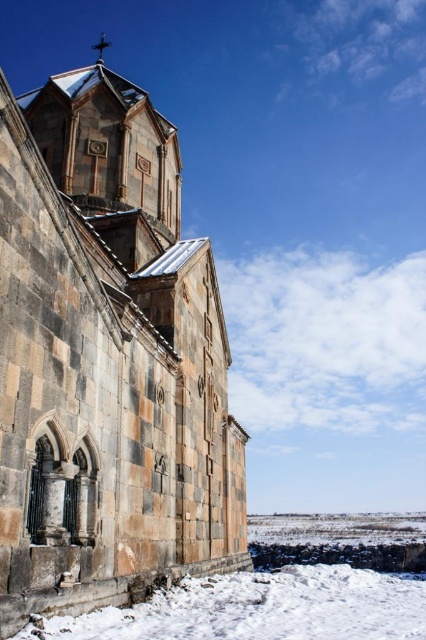
Between rustic stone church at center and white powdery snow at lower center, which one has more height?

Standing taller between the two is rustic stone church at center.

This screenshot has height=640, width=426. What do you see at coordinates (106, 356) in the screenshot?
I see `rustic stone church at center` at bounding box center [106, 356].

Between point (14, 189) and point (394, 614), which one is positioned behind?

The point (394, 614) is more distant.

Identify the location of rustic stone church at center. Image resolution: width=426 pixels, height=640 pixels. (106, 356).